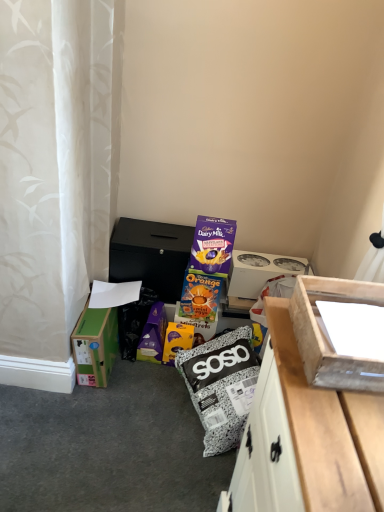
Question: Considering the relative positions of orange cardboard box at center, the first cardboard box in the bottom-to-top sequence, and green cardboard box at lower left, the first box viewed from the left, in the image provided, is orange cardboard box at center, the first cardboard box in the bottom-to-top sequence, to the left of green cardboard box at lower left, the first box viewed from the left, from the viewer's perspective?

Choices:
 (A) yes
 (B) no

Answer: (B)

Question: Is orange cardboard box at center, which is counted as the 2th cardboard box, starting from the top, directly adjacent to green cardboard box at lower left, which appears as the 3th box when viewed from the right?

Choices:
 (A) no
 (B) yes

Answer: (A)

Question: Can you confirm if orange cardboard box at center, the first cardboard box in the bottom-to-top sequence, is taller than green cardboard box at lower left, which appears as the 2th box when viewed from the front?

Choices:
 (A) yes
 (B) no

Answer: (B)

Question: Is the depth of orange cardboard box at center, which is counted as the 2th cardboard box, starting from the top, greater than that of green cardboard box at lower left, which appears as the 3th box when viewed from the right?

Choices:
 (A) yes
 (B) no

Answer: (A)

Question: Can you confirm if orange cardboard box at center, the first cardboard box in the bottom-to-top sequence, is smaller than green cardboard box at lower left, which appears as the 3th box when viewed from the right?

Choices:
 (A) no
 (B) yes

Answer: (B)

Question: Based on their positions, is wooden box at right, which is counted as the second box, starting from the left, located to the left or right of orange cardboard box at center, the first cardboard box in the bottom-to-top sequence?

Choices:
 (A) left
 (B) right

Answer: (B)

Question: In terms of width, does wooden box at right, the 3th box positioned from the back, look wider or thinner when compared to orange cardboard box at center, the first cardboard box in the bottom-to-top sequence?

Choices:
 (A) wide
 (B) thin

Answer: (A)

Question: From the image's perspective, is wooden box at right, arranged as the second box when viewed from the right, positioned above or below orange cardboard box at center, the first cardboard box in the bottom-to-top sequence?

Choices:
 (A) above
 (B) below

Answer: (A)

Question: Is wooden box at right, which is counted as the second box, starting from the left, spatially inside orange cardboard box at center, which is counted as the 2th cardboard box, starting from the top, or outside of it?

Choices:
 (A) inside
 (B) outside

Answer: (B)

Question: Is orange cardboard box at center, the first cardboard box in the bottom-to-top sequence, inside the boundaries of wooden box at right, arranged as the 1th box when viewed from the front, or outside?

Choices:
 (A) outside
 (B) inside

Answer: (A)

Question: Relative to wooden box at right, arranged as the second box when viewed from the right, is orange cardboard box at center, the first cardboard box in the bottom-to-top sequence, in front or behind?

Choices:
 (A) behind
 (B) front

Answer: (A)

Question: From a real-world perspective, is orange cardboard box at center, the first cardboard box in the bottom-to-top sequence, positioned above or below wooden box at right, arranged as the second box when viewed from the right?

Choices:
 (A) above
 (B) below

Answer: (B)

Question: Does point (183, 326) appear closer or farther from the camera than point (372, 376)?

Choices:
 (A) farther
 (B) closer

Answer: (A)

Question: In terms of size, does green cardboard box at lower left, which appears as the 3th box when viewed from the right, appear bigger or smaller than white cardboard box at upper right, marked as the 3th box in a left-to-right arrangement?

Choices:
 (A) small
 (B) big

Answer: (B)

Question: From the image's perspective, is green cardboard box at lower left, which appears as the 3th box when viewed from the right, positioned above or below white cardboard box at upper right, which is the 1th box from back to front?

Choices:
 (A) below
 (B) above

Answer: (A)